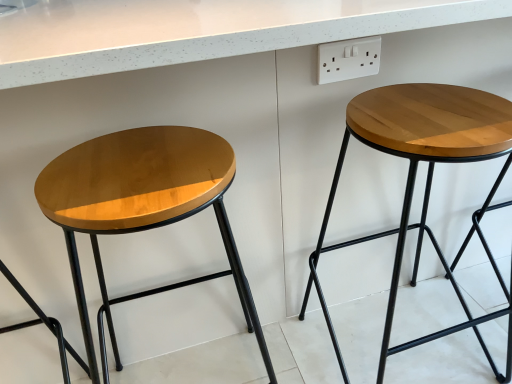
Question: Is white plastic socket at upper right outside glossy wood stool at left, the 1th stool viewed from the left?

Choices:
 (A) no
 (B) yes

Answer: (B)

Question: Is white plastic socket at upper right taller than glossy wood stool at left, positioned as the second stool in right-to-left order?

Choices:
 (A) no
 (B) yes

Answer: (A)

Question: From a real-world perspective, is white plastic socket at upper right located higher than glossy wood stool at left, positioned as the second stool in right-to-left order?

Choices:
 (A) yes
 (B) no

Answer: (A)

Question: Considering the relative positions of white plastic socket at upper right and glossy wood stool at left, positioned as the second stool in right-to-left order, in the image provided, is white plastic socket at upper right in front of glossy wood stool at left, positioned as the second stool in right-to-left order,?

Choices:
 (A) no
 (B) yes

Answer: (A)

Question: Is white plastic socket at upper right facing towards glossy wood stool at left, the 1th stool viewed from the left?

Choices:
 (A) yes
 (B) no

Answer: (B)

Question: Is wooden stool at right, which appears as the second stool when viewed from the left, inside or outside of glossy wood stool at left, the 1th stool viewed from the left?

Choices:
 (A) outside
 (B) inside

Answer: (A)

Question: Is wooden stool at right, which is the first stool from right to left, to the left or to the right of glossy wood stool at left, the 1th stool viewed from the left, in the image?

Choices:
 (A) right
 (B) left

Answer: (A)

Question: From a real-world perspective, relative to glossy wood stool at left, the 1th stool viewed from the left, is wooden stool at right, which is the first stool from right to left, vertically above or below?

Choices:
 (A) above
 (B) below

Answer: (B)

Question: Considering the positions of wooden stool at right, which appears as the second stool when viewed from the left, and glossy wood stool at left, positioned as the second stool in right-to-left order, in the image, is wooden stool at right, which appears as the second stool when viewed from the left, wider or thinner than glossy wood stool at left, positioned as the second stool in right-to-left order,?

Choices:
 (A) thin
 (B) wide

Answer: (B)

Question: Is glossy wood stool at left, the 1th stool viewed from the left, wider or thinner than wooden stool at right, which is the first stool from right to left?

Choices:
 (A) thin
 (B) wide

Answer: (A)

Question: Is point (199, 180) closer or farther from the camera than point (490, 132)?

Choices:
 (A) farther
 (B) closer

Answer: (B)

Question: Considering the positions of glossy wood stool at left, positioned as the second stool in right-to-left order, and wooden stool at right, which is the first stool from right to left, in the image, is glossy wood stool at left, positioned as the second stool in right-to-left order, taller or shorter than wooden stool at right, which is the first stool from right to left,?

Choices:
 (A) short
 (B) tall

Answer: (B)

Question: Relative to wooden stool at right, which is the first stool from right to left, is glossy wood stool at left, the 1th stool viewed from the left, in front or behind?

Choices:
 (A) behind
 (B) front

Answer: (B)

Question: Is white plastic socket at upper right bigger or smaller than glossy wood stool at left, the 1th stool viewed from the left?

Choices:
 (A) small
 (B) big

Answer: (A)

Question: From the image's perspective, is white plastic socket at upper right positioned above or below glossy wood stool at left, the 1th stool viewed from the left?

Choices:
 (A) above
 (B) below

Answer: (A)